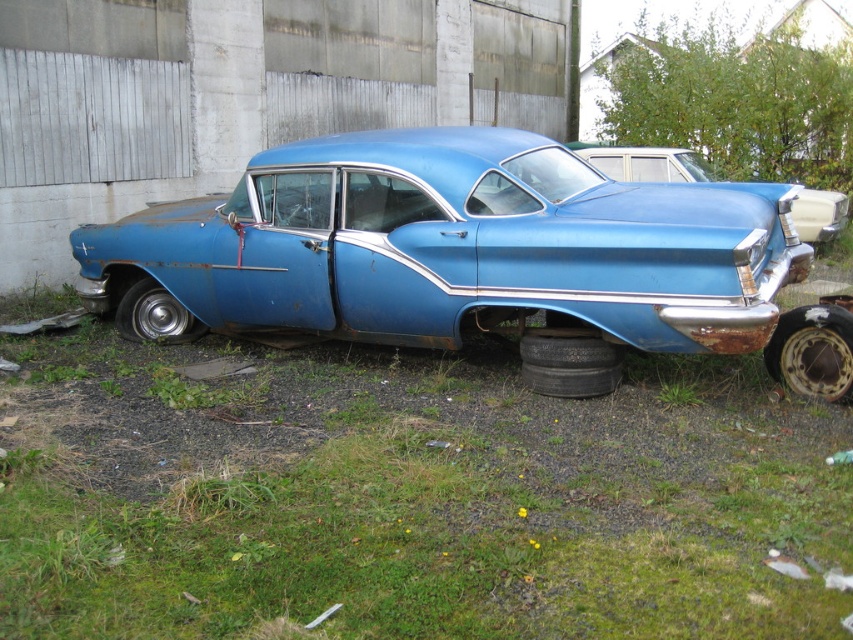
Question: Estimate the real-world distances between objects in this image. Which object is closer to the rusty metallic car at right?

Choices:
 (A) rusty metal tire at lower left
 (B) rusty metal tire at lower right
 (C) rusty blue car at center
 (D) black rubber tire at lower right

Answer: (B)

Question: Based on their relative distances, which object is farther from the green grass at lower center?

Choices:
 (A) rusty metal tire at lower left
 (B) black rubber tire at lower right

Answer: (A)

Question: Is green grass at lower center positioned at the back of rusty metal tire at lower right?

Choices:
 (A) yes
 (B) no

Answer: (B)

Question: Is rusty blue car at center to the left of rusty metal tire at lower left from the viewer's perspective?

Choices:
 (A) yes
 (B) no

Answer: (B)

Question: Estimate the real-world distances between objects in this image. Which object is closer to the rusty metal tire at lower left?

Choices:
 (A) rusty blue car at center
 (B) green grass at lower center
 (C) rusty metal tire at lower right
 (D) black rubber tire at lower right

Answer: (A)

Question: Can you confirm if green grass at lower center is wider than rusty metal tire at lower right?

Choices:
 (A) yes
 (B) no

Answer: (A)